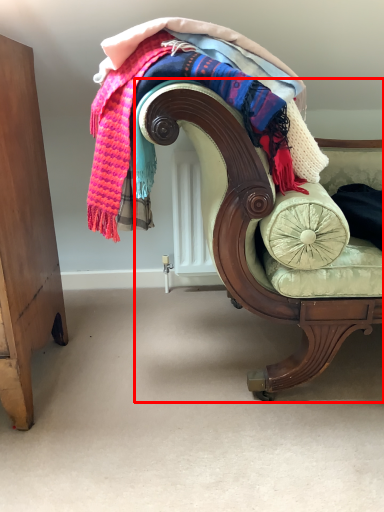
Question: In this image, where is chair (annotated by the red box) located relative to laundry?

Choices:
 (A) left
 (B) right

Answer: (B)